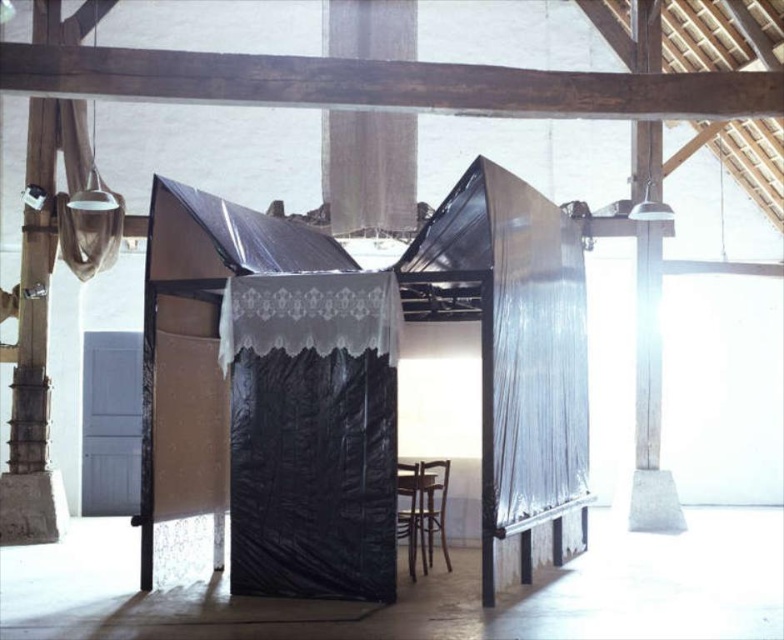
Question: Which point is closer to the camera taking this photo?

Choices:
 (A) (412, 545)
 (B) (456, 291)
 (C) (82, 253)

Answer: (A)

Question: Can you confirm if black plastic canopy bed at center is bigger than black lace curtain at center?

Choices:
 (A) no
 (B) yes

Answer: (B)

Question: Which of the following is the closest to the observer?

Choices:
 (A) (412, 472)
 (B) (234, 292)

Answer: (B)

Question: Is white lace curtain at upper left below brown wooden chair at lower center?

Choices:
 (A) no
 (B) yes

Answer: (A)

Question: Does black lace curtain at center appear under white lace curtain at upper left?

Choices:
 (A) no
 (B) yes

Answer: (B)

Question: Estimate the real-world distances between objects in this image. Which object is closer to the white lace curtain at upper left?

Choices:
 (A) brown wooden chair at lower center
 (B) black plastic canopy bed at center

Answer: (B)